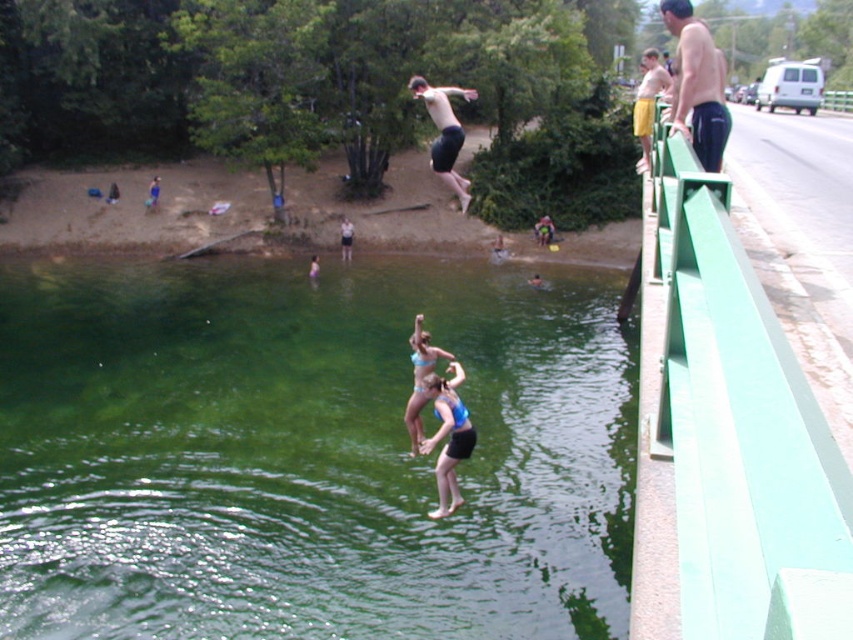
You are a swimmer preparing to jump into the green translucent water at center. You notice the blue fabric shorts at center nearby. Which object occupies a bigger area in the image?

The green translucent water at center is larger in size than the blue fabric shorts at center, so the water takes up more space in the image.

You are a swimmer standing on the bridge and see the green translucent water at center and the skinny jeans at right. Which object is closer to the water surface?

The green translucent water at center is below the skinny jeans at right, so the skinny jeans at right is closer to the water surface.

You are a photographer positioned on the bridge and want to capture both the green translucent water at center and the blue fabric shorts at center in a single shot. Which object will appear larger in your photo?

The green translucent water at center will appear larger in the photo because it is closer to the viewer than the blue fabric shorts at center.